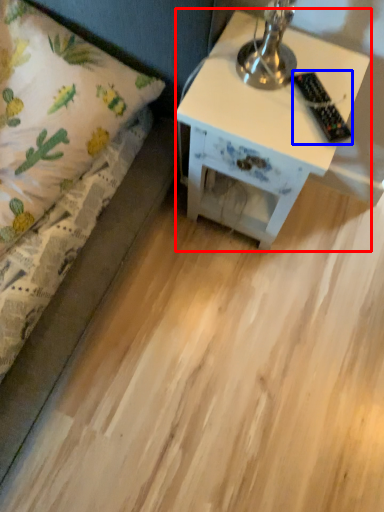
Question: Among these objects, which one is farthest to the camera, nightstand (highlighted by a red box) or remote control (highlighted by a blue box)?

Choices:
 (A) nightstand
 (B) remote control

Answer: (A)